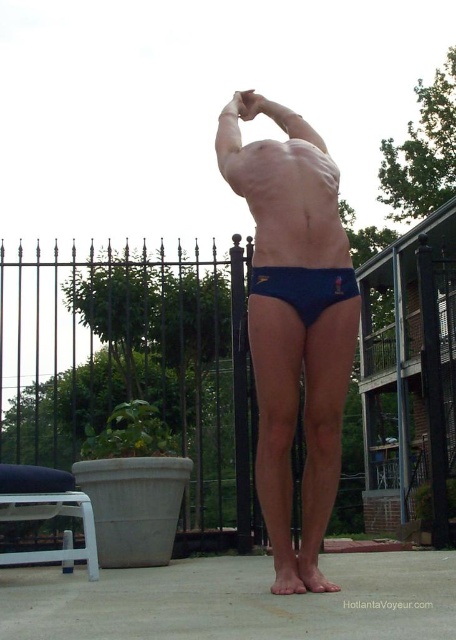
You are a photographer setting up for a photoshoot on the patio. You have two outfits to choose from for the model to wear. The first is the blue matte underwear at center, and the second is the navy blue fabric briefs at center. If you want the outfit to appear more prominent in the photo, which one should the model wear?

The blue matte underwear at center is closer to the viewer, so if the model wears it, it will appear more prominent in the photo compared to the navy blue fabric briefs at center which are further away.